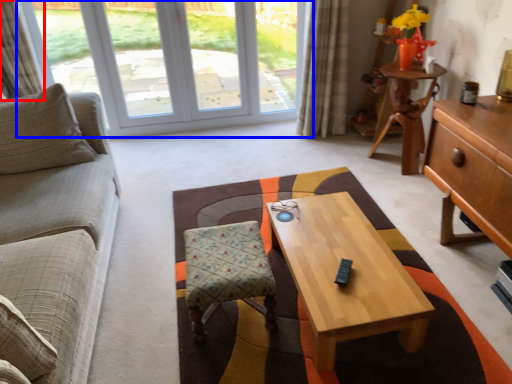
Question: Which point is further to the camera, curtain (highlighted by a red box) or window (highlighted by a blue box)?

Choices:
 (A) curtain
 (B) window

Answer: (B)